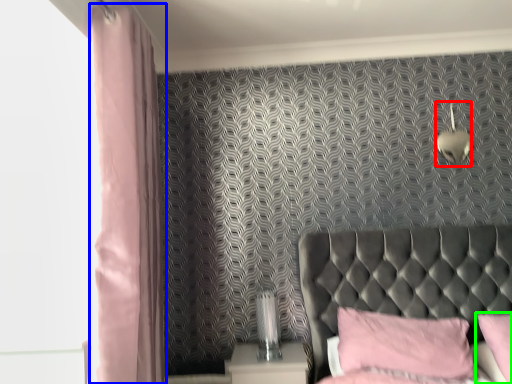
Question: Which object is the farthest from light fixture (highlighted by a red box)? Choose among these: curtain (highlighted by a blue box) or pillow (highlighted by a green box).

Choices:
 (A) curtain
 (B) pillow

Answer: (A)